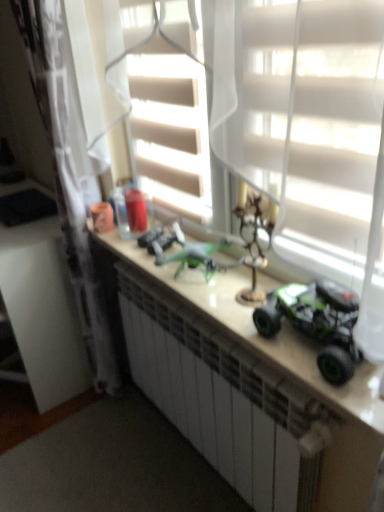
Image resolution: width=384 pixels, height=512 pixels. Describe the element at coordinates (285, 371) in the screenshot. I see `green plastic toy car at center` at that location.

This screenshot has height=512, width=384. What are the coordinates of `white glossy vanity at left` in the screenshot? It's located at (43, 311).

This screenshot has width=384, height=512. What do you see at coordinates (317, 323) in the screenshot?
I see `green matte toy car at right, the first toy positioned from the front` at bounding box center [317, 323].

This screenshot has width=384, height=512. In order to click on green plastic toy car at center in this screenshot , I will do `click(285, 371)`.

From a real-world perspective, is white sheer curtain at left over green matte toy car at right, the 1th toy from the right?

No, from a real-world perspective, white sheer curtain at left is not over green matte toy car at right, the 1th toy from the right

Can green matte toy car at right, marked as the third toy in a left-to-right arrangement, be found inside white sheer curtain at left?

Definitely not — green matte toy car at right, marked as the third toy in a left-to-right arrangement, is not inside white sheer curtain at left.

Could you tell me if white sheer curtain at left is turned towards green matte toy car at right, the 1th toy from the right?

No, white sheer curtain at left is not oriented towards green matte toy car at right, the 1th toy from the right.

Does white sheer curtain at left have a smaller size compared to green matte toy car at right, the first toy positioned from the front?

Incorrect, white sheer curtain at left is not smaller in size than green matte toy car at right, the first toy positioned from the front.

How distant is green matte toy car at right, which is counted as the 3th toy, starting from the back, from metallic green drone at center, the 2th toy in the back-to-front sequence?

green matte toy car at right, which is counted as the 3th toy, starting from the back, and metallic green drone at center, the 2th toy in the back-to-front sequence, are 6.94 inches apart from each other.

From a real-world perspective, is green matte toy car at right, marked as the third toy in a left-to-right arrangement, on top of metallic green drone at center, the second toy in the left-to-right sequence?

No, from a real-world perspective, green matte toy car at right, marked as the third toy in a left-to-right arrangement, is not on top of metallic green drone at center, the second toy in the left-to-right sequence.

Locate an element on the screen. This screenshot has width=384, height=512. toy that is the 1st one when counting leftward from the green matte toy car at right, which is counted as the 3th toy, starting from the back is located at coordinates (254, 243).

From the image's perspective, is green matte toy car at right, which is counted as the 3th toy, starting from the back, on metallic green drone at center, the 2th toy in the back-to-front sequence?

No, from the image's perspective, green matte toy car at right, which is counted as the 3th toy, starting from the back, is not over metallic green drone at center, the 2th toy in the back-to-front sequence.

Which of these two, metallic green drone at center, the second toy in the right-to-left sequence, or green matte toy car at right, which is counted as the 3th toy, starting from the back, stands taller?

Standing taller between the two is metallic green drone at center, the second toy in the right-to-left sequence.

From a real-world perspective, is metallic green drone at center, positioned as the 2th toy in front-to-back order, positioned under green matte toy car at right, the first toy positioned from the front, based on gravity?

No, from a real-world perspective, metallic green drone at center, positioned as the 2th toy in front-to-back order, is not below green matte toy car at right, the first toy positioned from the front.

Which point is more distant from viewer, (261, 257) or (293, 323)?

The point (261, 257) is farther.

How many degrees apart are the facing directions of white sheer curtain at left and green plastic toy car at center?

2.16 degrees separate the facing orientations of white sheer curtain at left and green plastic toy car at center.

Considering the sizes of objects white sheer curtain at left and green plastic toy car at center in the image provided, who is shorter, white sheer curtain at left or green plastic toy car at center?

green plastic toy car at center is shorter.

Does white sheer curtain at left lie behind green plastic toy car at center?

Yes, white sheer curtain at left is behind green plastic toy car at center.

From a real-world perspective, count 2nd toys upward from the green plastic toy car at center and point to it. Please provide its 2D coordinates.

[(317, 323)]

Considering the sizes of green plastic toy car at center and green matte toy car at right, the 1th toy from the right, in the image, is green plastic toy car at center taller or shorter than green matte toy car at right, the 1th toy from the right,?

Considering their sizes, green plastic toy car at center has more height than green matte toy car at right, the 1th toy from the right.

From the image's perspective, which one is positioned lower, green plastic toy car at center or green matte toy car at right, marked as the third toy in a left-to-right arrangement?

From the image's view, green plastic toy car at center is below.

Is green plastic toy car at center next to green matte toy car at right, which is counted as the 3th toy, starting from the back?

No, green plastic toy car at center is not making contact with green matte toy car at right, which is counted as the 3th toy, starting from the back.

Who is bigger, green matte toy car at right, marked as the third toy in a left-to-right arrangement, or white glossy vanity at left?

white glossy vanity at left.

Looking at this image, is green matte toy car at right, the first toy positioned from the front, taller or shorter than white glossy vanity at left?

green matte toy car at right, the first toy positioned from the front, is shorter than white glossy vanity at left.

Is point (308, 309) farther from camera compared to point (36, 301)?

No.

Based on the photo, from a real-world perspective, which object stands above the other?

green matte toy car at right, the 1th toy from the right, from a real-world perspective.

In the scene shown: Which of these two, white glossy vanity at left or white sheer curtain at left, is bigger?

With larger size is white glossy vanity at left.

Can you confirm if white glossy vanity at left is taller than white sheer curtain at left?

No.

Is white glossy vanity at left to the left or to the right of white sheer curtain at left in the image?

Based on their positions, white glossy vanity at left is located to the left of white sheer curtain at left.

Which toy is the 2nd one when counting from the front of the white sheer curtain at left? Please provide its 2D coordinates.

[(317, 323)]

Locate an element on the screen. The image size is (384, 512). toy that is the 1st one when counting upward from the green matte toy car at right, marked as the third toy in a left-to-right arrangement (from the image's perspective) is located at coordinates (254, 243).

When comparing their distances from green plastic toy car at center, does green matte toy car at right, the first toy positioned from the front, or metallic green drone at center, the 2th toy in the back-to-front sequence, seem further?

metallic green drone at center, the 2th toy in the back-to-front sequence.

When comparing their distances from green matte toy car at right, marked as the third toy in a left-to-right arrangement, does metallic green drone at center, the 2th toy in the back-to-front sequence, or green matte toy car at center, the first toy in the left-to-right sequence, seem further?

Among the two, green matte toy car at center, the first toy in the left-to-right sequence, is located further to green matte toy car at right, marked as the third toy in a left-to-right arrangement.

From the image, which object appears to be nearer to green plastic toy car at center, green matte toy car at right, the 1th toy from the right, or white sheer curtain at left?

green matte toy car at right, the 1th toy from the right, is closer to green plastic toy car at center.

Which object lies further to the anchor point green matte toy car at right, the first toy positioned from the front, green plastic toy car at center or metallic green drone at center, the second toy in the right-to-left sequence?

metallic green drone at center, the second toy in the right-to-left sequence, lies further to green matte toy car at right, the first toy positioned from the front, than the other object.

Considering their positions, is green matte toy car at right, which is counted as the 3th toy, starting from the back, positioned further to white glossy vanity at left than green plastic toy car at center?

green matte toy car at right, which is counted as the 3th toy, starting from the back, is positioned further to the anchor white glossy vanity at left.

Which object lies nearer to the anchor point green matte toy car at center, the first toy in the left-to-right sequence, white glossy vanity at left or green plastic toy car at center?

Among the two, green plastic toy car at center is located nearer to green matte toy car at center, the first toy in the left-to-right sequence.

Considering their positions, is white sheer curtain at left positioned closer to green matte toy car at center, the 1th toy positioned from the back, than green plastic toy car at center?

Among the two, green plastic toy car at center is located nearer to green matte toy car at center, the 1th toy positioned from the back.

Which object lies nearer to the anchor point white sheer curtain at left, white glossy vanity at left or green matte toy car at center, the third toy from the right?

The object closer to white sheer curtain at left is white glossy vanity at left.

The height and width of the screenshot is (512, 384). I want to click on counter between white sheer curtain at left and metallic green drone at center, the second toy in the left-to-right sequence, from left to right, so click(285, 371).

Where is `toy between metallic green drone at center, the second toy in the left-to-right sequence, and green plastic toy car at center vertically`? The height and width of the screenshot is (512, 384). toy between metallic green drone at center, the second toy in the left-to-right sequence, and green plastic toy car at center vertically is located at coordinates (317, 323).

In order to click on curtain between white glossy vanity at left and green plastic toy car at center from left to right in this screenshot , I will do `click(67, 180)`.

I want to click on toy situated between white glossy vanity at left and green plastic toy car at center from left to right, so click(x=161, y=240).